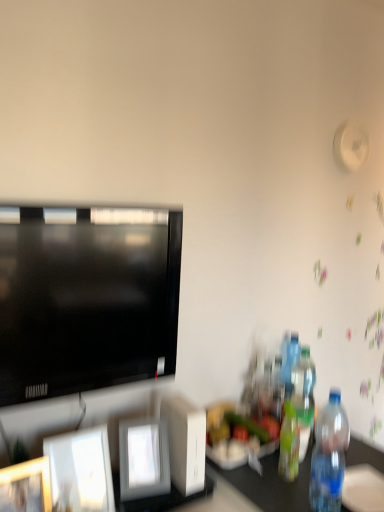
Question: Would you say translucent plastic bottle at right, the third bottle positioned from the front, is a long distance from transparent plastic bottle at right, which ranks as the 1th bottle in front-to-back order?

Choices:
 (A) yes
 (B) no

Answer: (B)

Question: Is transparent plastic bottle at right, the fourth bottle in the back-to-front sequence, a part of translucent plastic bottle at right, the third bottle positioned from the front?

Choices:
 (A) yes
 (B) no

Answer: (B)

Question: Considering the relative sizes of translucent plastic bottle at right, the third bottle positioned from the front, and transparent plastic bottle at right, the fourth bottle in the back-to-front sequence, in the image provided, is translucent plastic bottle at right, the third bottle positioned from the front, shorter than transparent plastic bottle at right, the fourth bottle in the back-to-front sequence,?

Choices:
 (A) no
 (B) yes

Answer: (B)

Question: Does translucent plastic bottle at right, the third bottle positioned from the front, appear on the right side of transparent plastic bottle at right, the fourth bottle in the back-to-front sequence?

Choices:
 (A) yes
 (B) no

Answer: (A)

Question: Is translucent plastic bottle at right, the third bottle positioned from the front, turned away from transparent plastic bottle at right, which ranks as the 1th bottle in front-to-back order?

Choices:
 (A) yes
 (B) no

Answer: (B)

Question: Can you confirm if translucent plastic bottle at right, the third bottle positioned from the front, is smaller than transparent plastic bottle at right, which ranks as the 1th bottle in front-to-back order?

Choices:
 (A) yes
 (B) no

Answer: (A)

Question: Is translucent plastic bottle at right, marked as the 1th bottle in a back-to-front arrangement, outside translucent plastic bottle at right, the 3th bottle viewed from the back?

Choices:
 (A) yes
 (B) no

Answer: (A)

Question: Considering the relative sizes of translucent plastic bottle at right, marked as the 1th bottle in a back-to-front arrangement, and translucent plastic bottle at right, the 3th bottle viewed from the back, in the image provided, is translucent plastic bottle at right, marked as the 1th bottle in a back-to-front arrangement, taller than translucent plastic bottle at right, the 3th bottle viewed from the back,?

Choices:
 (A) no
 (B) yes

Answer: (B)

Question: From a real-world perspective, is translucent plastic bottle at right, the 4th bottle viewed from the front, on top of translucent plastic bottle at right, which is the second bottle from front to back?

Choices:
 (A) yes
 (B) no

Answer: (A)

Question: Considering the relative sizes of translucent plastic bottle at right, the 4th bottle viewed from the front, and translucent plastic bottle at right, which is the second bottle from front to back, in the image provided, is translucent plastic bottle at right, the 4th bottle viewed from the front, thinner than translucent plastic bottle at right, which is the second bottle from front to back,?

Choices:
 (A) yes
 (B) no

Answer: (B)

Question: Does translucent plastic bottle at right, marked as the 1th bottle in a back-to-front arrangement, turn towards translucent plastic bottle at right, the 3th bottle viewed from the back?

Choices:
 (A) no
 (B) yes

Answer: (A)

Question: Is translucent plastic bottle at right, the 4th bottle viewed from the front, not near translucent plastic bottle at right, which is the second bottle from front to back?

Choices:
 (A) yes
 (B) no

Answer: (B)

Question: Does translucent plastic bottle at right, which is the second bottle from front to back, have a greater height compared to transparent plastic bottle at right, the fourth bottle in the back-to-front sequence?

Choices:
 (A) yes
 (B) no

Answer: (B)